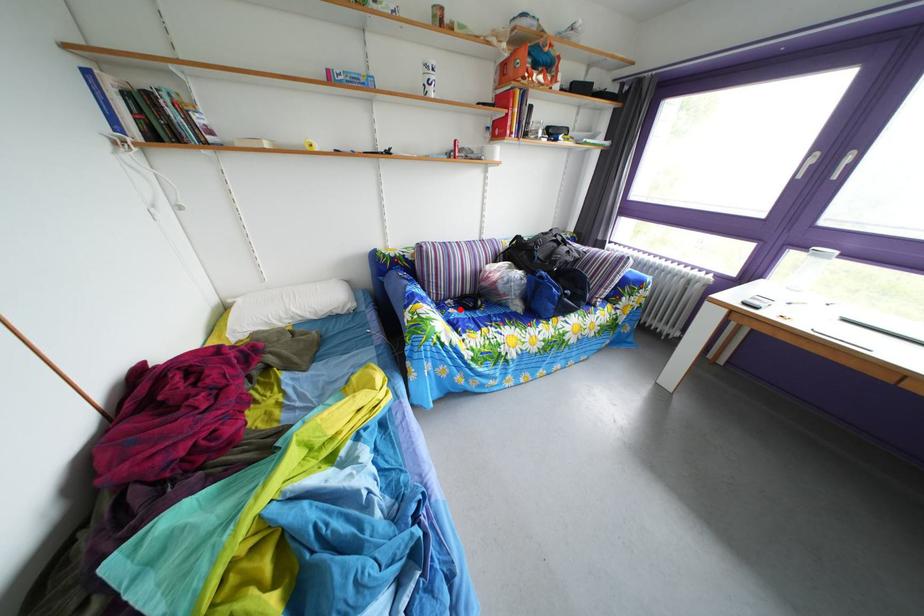
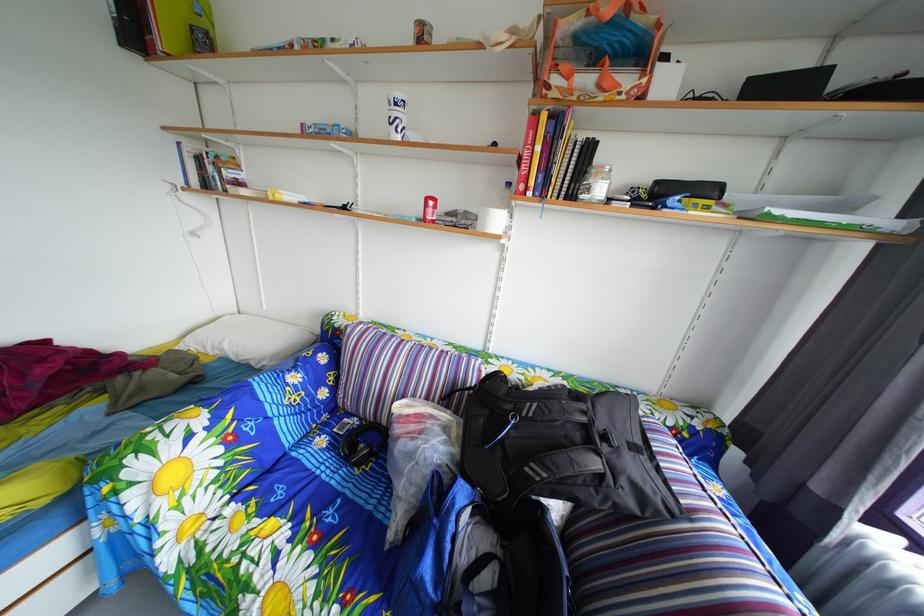
The point at the highlighted location is marked in the first image. Where is the corresponding point in the second image?

(367, 428)